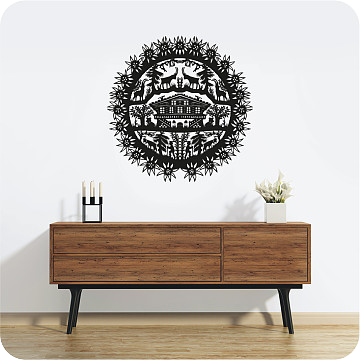
Find the location of a particular element. The image size is (360, 360). floor is located at coordinates (224, 342).